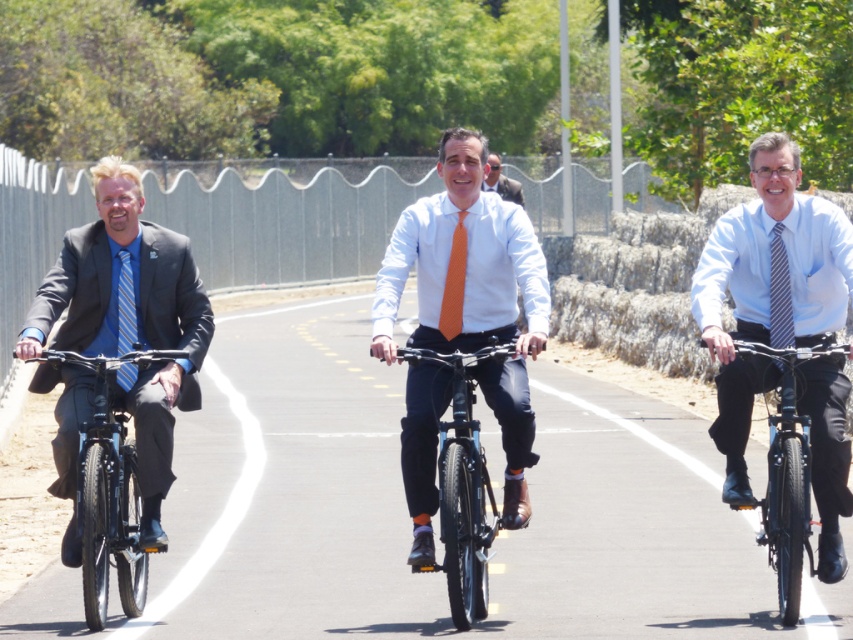
Question: Is black matte bicycle at right to the left of orange tie at center from the viewer's perspective?

Choices:
 (A) yes
 (B) no

Answer: (B)

Question: Estimate the real-world distances between objects in this image. Which object is farther from the orange satin tie at center?

Choices:
 (A) orange silk tie at center
 (B) light blue shirt and tie at center
 (C) orange tie at center

Answer: (B)

Question: Which object appears farthest from the camera in this image?

Choices:
 (A) orange satin tie at center
 (B) light blue shirt and tie at center

Answer: (A)

Question: Is black rubber bike path at center in front of light blue shirt and tie at center?

Choices:
 (A) no
 (B) yes

Answer: (B)

Question: Does light blue shirt and tie at center have a larger size compared to striped fabric tie at center?

Choices:
 (A) no
 (B) yes

Answer: (B)

Question: Which point appears farthest from the camera in this image?

Choices:
 (A) (521, 262)
 (B) (131, 323)

Answer: (B)